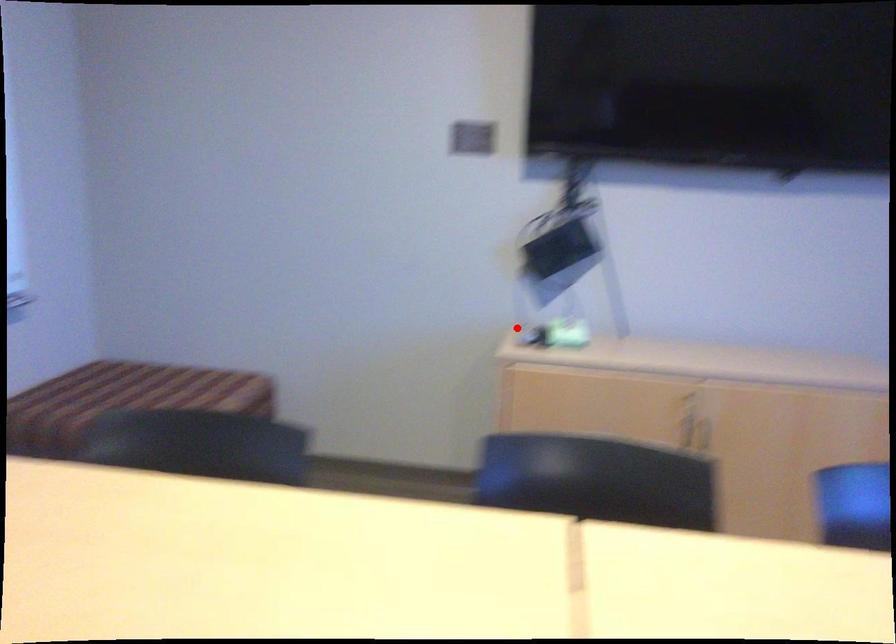
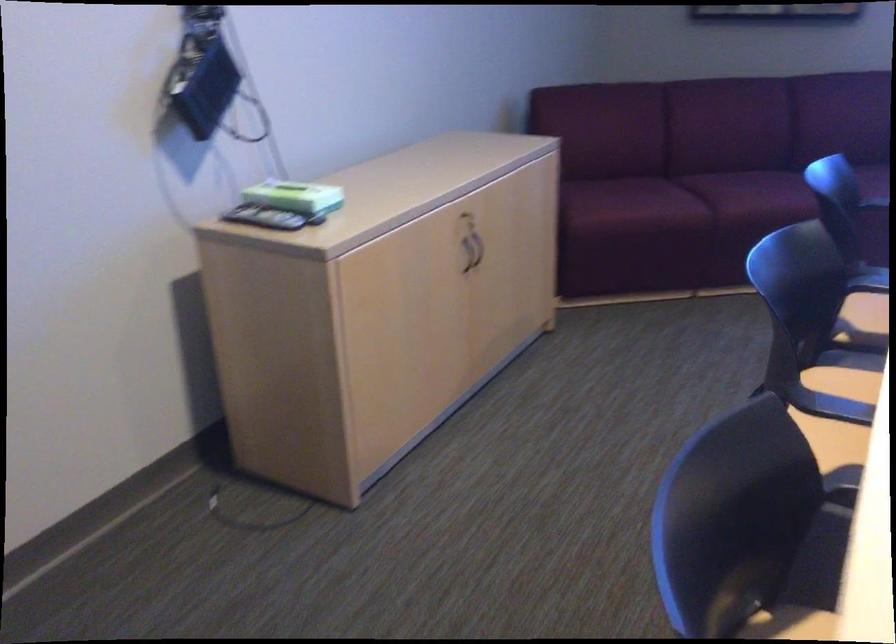
Question: A red point is marked in image1. In image2, is the corresponding 3D point closer to the camera or farther? Reply with the corresponding letter.

Choices:
 (A) The corresponding 3D point is closer.
 (B) The corresponding 3D point is farther.

Answer: (A)